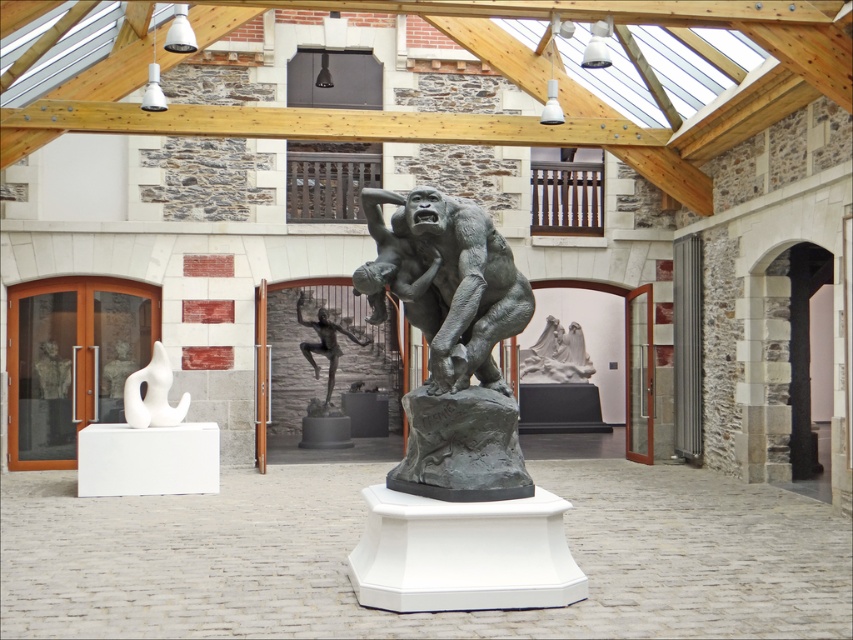
In the scene shown: You are an art student standing in the courtyard and want to take a photo of both the bronze statue at center and the white glossy abstract sculpture at left. Since you can only focus on one object at a time, which one should you focus on first to ensure the other is still in the background?

You should focus on the bronze statue at center first because it is closer to you than the white glossy abstract sculpture at left, so when focused on the closer object, the farther one will naturally be in the background and still in focus.

Consider the image. You are an art student who wants to sketch the white glossy abstract sculpture at left and the bronze nude figure at center. Since you can only focus on one at a time, which one would you need to look down at first?

The white glossy abstract sculpture at left is located below the bronze nude figure at center, so you would need to look down at the white glossy abstract sculpture at left first.

You are an art curator planning to place a new sculpture that is 1.2 meters wide between the bronze statue at center and the bronze nude figure at center. Can the space between them accommodate this new sculpture?

The bronze statue at center has a lesser width compared to bronze nude figure at center, so the space between them may be sufficient to place the new sculpture. However, without exact measurements of the distance between the two existing sculptures, it is difficult to confirm if the 1.2 meter wide sculpture will fit.